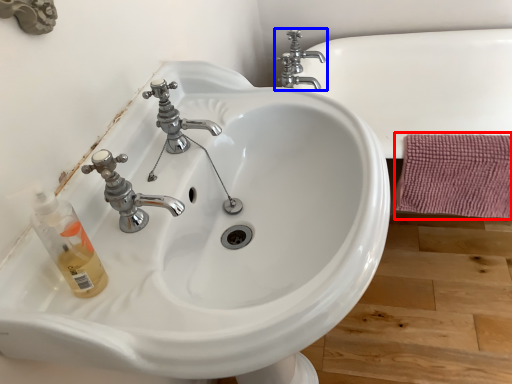
Question: Which object is closer to the camera taking this photo, bath towel (highlighted by a red box) or tap (highlighted by a blue box)?

Choices:
 (A) bath towel
 (B) tap

Answer: (A)